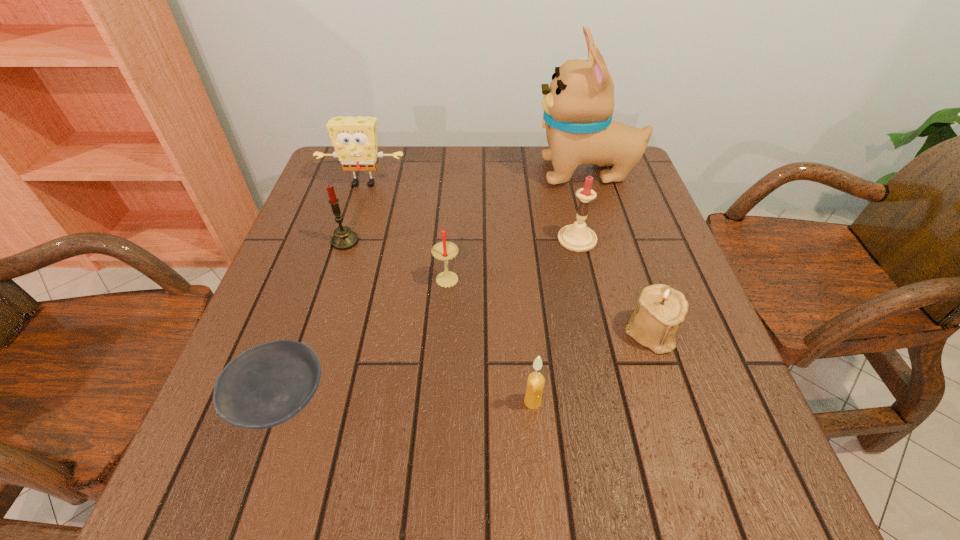
Image resolution: width=960 pixels, height=540 pixels. In order to click on free space located 0.180m on the face of the puppy in this screenshot , I will do `click(469, 173)`.

The height and width of the screenshot is (540, 960). In order to click on vacant region located on the face of the puppy in this screenshot , I will do `click(501, 173)`.

The height and width of the screenshot is (540, 960). I want to click on free location located 0.300m on the face of the puppy, so click(x=426, y=173).

The height and width of the screenshot is (540, 960). Identify the location of vacant point located 0.300m on the face of the sponge. pyautogui.click(x=335, y=274).

At what (x,y) coordinates should I click in order to perform the action: click on vacant region located on the left of the rightmost candle. Please return your answer as a coordinate pair (x, y). Looking at the image, I should click on (507, 239).

Image resolution: width=960 pixels, height=540 pixels. What are the coordinates of `free space located 0.250m on the back of the leftmost candle` in the screenshot? It's located at (367, 174).

At what (x,y) coordinates should I click in order to perform the action: click on blank space located 0.170m on the back of the fifth object from left to right. Please return your answer as a coordinate pair (x, y). This screenshot has width=960, height=540. Looking at the image, I should click on (525, 316).

This screenshot has height=540, width=960. I want to click on free space located 0.070m on the right of the third candle from right to left, so click(492, 277).

At what (x,y) coordinates should I click in order to perform the action: click on free location located 0.340m on the back of the candle_holder. Please return your answer as a coordinate pair (x, y). Looking at the image, I should click on (610, 209).

The image size is (960, 540). Find the location of `free location located on the back of the shortest object`. free location located on the back of the shortest object is located at coordinates (336, 241).